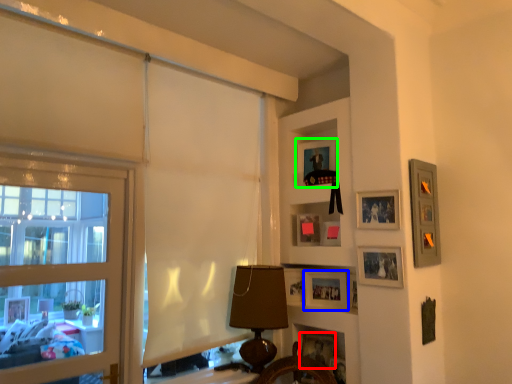
Question: Considering the real-world distances, which object is closest to picture frame (highlighted by a red box)? picture frame (highlighted by a blue box) or picture frame (highlighted by a green box).

Choices:
 (A) picture frame
 (B) picture frame

Answer: (A)